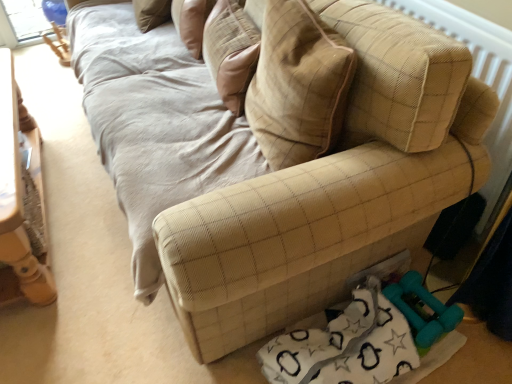
Find the location of a particular element. free spot to the right of wooden table at left is located at coordinates (101, 233).